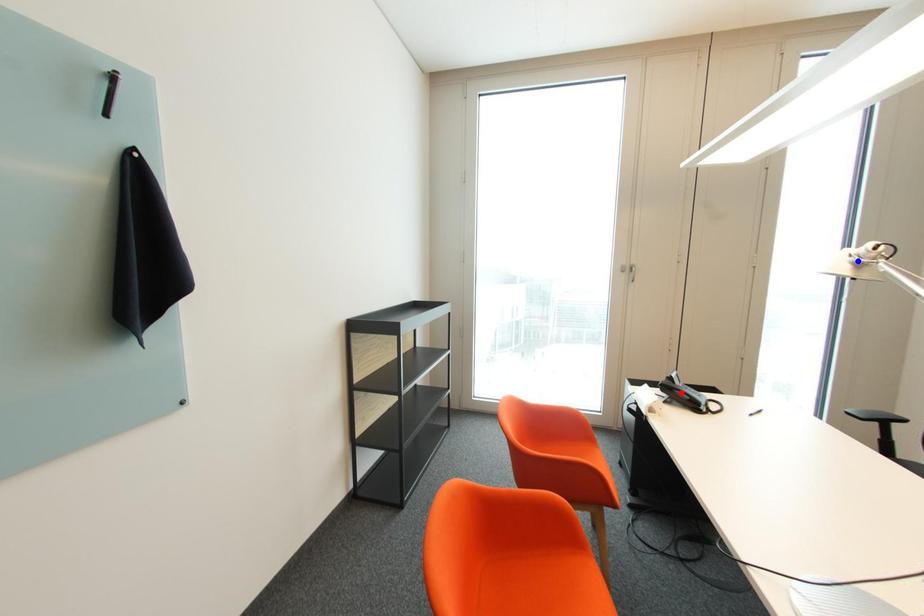
Question: In the image, two points are highlighted. Which point is nearer to the camera? Reply with the corresponding letter.

Choices:
 (A) blue point
 (B) red point

Answer: (A)